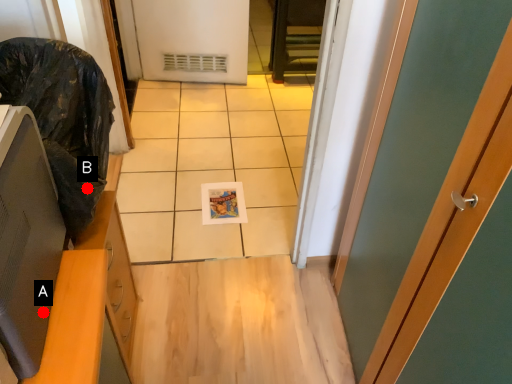
Question: Two points are circled on the image, labeled by A and B beside each circle. Which point is closer to the camera?

Choices:
 (A) A is closer
 (B) B is closer

Answer: (A)